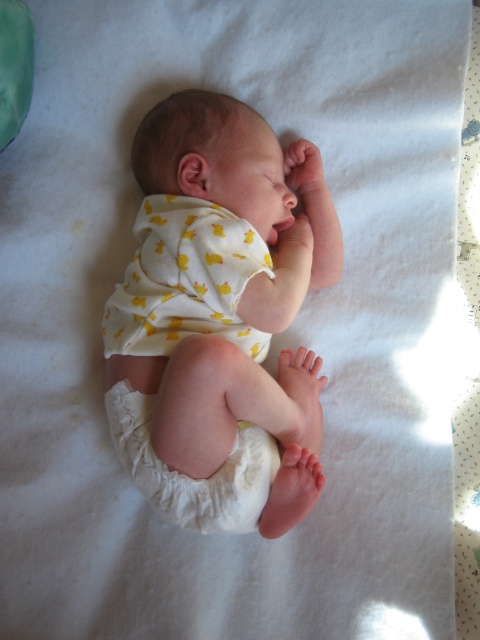
A parent wants to change the white cloth diaper at lower center while keeping the white cotton newborn at center comfortable. What is the minimum distance they need to move the diaper to ensure it doesn

The minimum distance the parent needs to move the white cloth diaper at lower center is 13.34 centimeters to ensure it is positioned correctly while keeping the white cotton newborn at center comfortable.

You are a caregiver who needs to change the diaper of the baby in the image. Can you easily access the white cloth diaper at lower center without moving the white cotton newborn at center?

The white cotton newborn at center is positioned over the white cloth diaper at lower center, so you cannot easily access the white cloth diaper at lower center without moving the white cotton newborn at center.

You are a new parent trying to dress your baby. You have a white cotton newborn at center and a white cloth diaper at lower center. Which item should you use to swaddle the baby?

The white cotton newborn at center should be used to swaddle the baby because it has a larger size compared to the white cloth diaper at lower center, making it more suitable for wrapping the baby comfortably.